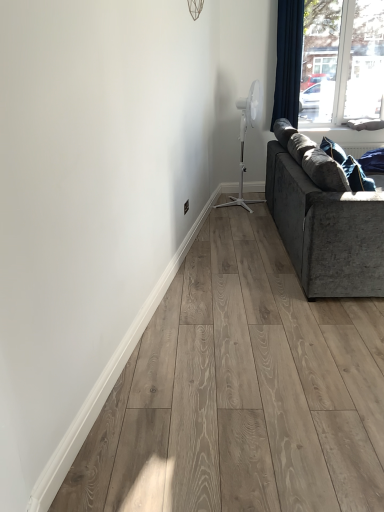
Question: Is denim pillow at lower right situated inside transparent glass window at upper right or outside?

Choices:
 (A) outside
 (B) inside

Answer: (A)

Question: Looking at the image, does denim pillow at lower right seem bigger or smaller compared to transparent glass window at upper right?

Choices:
 (A) big
 (B) small

Answer: (B)

Question: Which object is positioned closest to the white plastic fan at upper right?

Choices:
 (A) denim pillow at lower right
 (B) dark blue fabric curtain at upper right
 (C) velvet grey couch at right
 (D) transparent glass window at upper right

Answer: (B)

Question: Estimate the real-world distances between objects in this image. Which object is farther from the white plastic fan at upper right?

Choices:
 (A) denim pillow at lower right
 (B) transparent glass window at upper right
 (C) velvet grey couch at right
 (D) dark blue fabric curtain at upper right

Answer: (C)